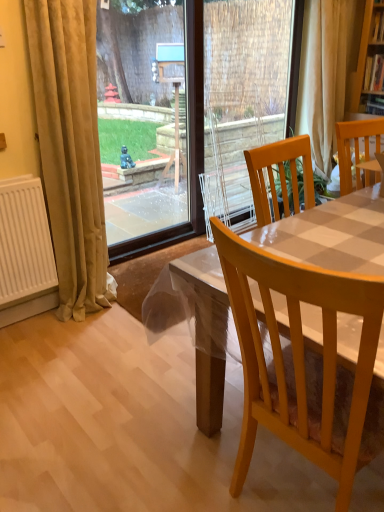
Question: From a real-world perspective, does beige fabric curtain at upper right, which is the 2th curtain from bottom to top, sit lower than beige velvet curtain at left, arranged as the second curtain when viewed from the back?

Choices:
 (A) yes
 (B) no

Answer: (B)

Question: Is beige fabric curtain at upper right, the first curtain when ordered from top to bottom, thinner than beige velvet curtain at left, the second curtain viewed from the top?

Choices:
 (A) no
 (B) yes

Answer: (A)

Question: Can you confirm if beige fabric curtain at upper right, the first curtain when ordered from top to bottom, is shorter than beige velvet curtain at left, marked as the 2th curtain in a right-to-left arrangement?

Choices:
 (A) no
 (B) yes

Answer: (B)

Question: Is beige fabric curtain at upper right, which is the 2th curtain from bottom to top, positioned beyond the bounds of beige velvet curtain at left, which ranks as the 1th curtain in bottom-to-top order?

Choices:
 (A) yes
 (B) no

Answer: (A)

Question: From the image's perspective, is beige fabric curtain at upper right, positioned as the 2th curtain in left-to-right order, below beige velvet curtain at left, marked as the 2th curtain in a right-to-left arrangement?

Choices:
 (A) no
 (B) yes

Answer: (A)

Question: Is point (114, 241) positioned closer to the camera than point (274, 137)?

Choices:
 (A) closer
 (B) farther

Answer: (A)

Question: From the image's perspective, is transparent glass door at upper left positioned above or below clear plastic screen door at center?

Choices:
 (A) above
 (B) below

Answer: (B)

Question: Relative to clear plastic screen door at center, is transparent glass door at upper left in front or behind?

Choices:
 (A) front
 (B) behind

Answer: (A)

Question: From a real-world perspective, is transparent glass door at upper left positioned above or below clear plastic screen door at center?

Choices:
 (A) below
 (B) above

Answer: (A)

Question: In terms of width, does beige velvet curtain at left, the second curtain viewed from the top, look wider or thinner when compared to clear plastic screen door at center?

Choices:
 (A) wide
 (B) thin

Answer: (A)

Question: Is point (62, 35) positioned closer to the camera than point (210, 33)?

Choices:
 (A) closer
 (B) farther

Answer: (A)

Question: From a real-world perspective, is beige velvet curtain at left, which appears as the first curtain when viewed from the front, above or below clear plastic screen door at center?

Choices:
 (A) below
 (B) above

Answer: (A)

Question: In terms of height, does beige velvet curtain at left, marked as the 2th curtain in a right-to-left arrangement, look taller or shorter compared to clear plastic screen door at center?

Choices:
 (A) tall
 (B) short

Answer: (B)

Question: Considering the positions of beige fabric curtain at upper right, the first curtain when ordered from top to bottom, and light brown wooden chair at center, arranged as the 1th chair when viewed from the left, in the image, is beige fabric curtain at upper right, the first curtain when ordered from top to bottom, taller or shorter than light brown wooden chair at center, arranged as the 1th chair when viewed from the left,?

Choices:
 (A) short
 (B) tall

Answer: (B)

Question: In terms of width, does beige fabric curtain at upper right, marked as the first curtain in a right-to-left arrangement, look wider or thinner when compared to light brown wooden chair at center, the second chair when ordered from top to bottom?

Choices:
 (A) thin
 (B) wide

Answer: (A)